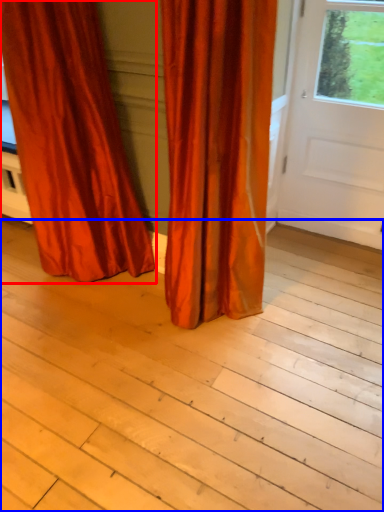
Question: Which object is closer to the camera taking this photo, curtain (highlighted by a red box) or plank (highlighted by a blue box)?

Choices:
 (A) curtain
 (B) plank

Answer: (B)